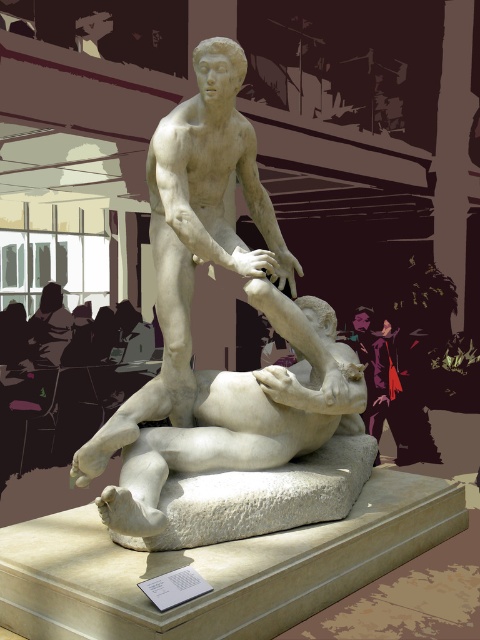
Does white marble statue at center have a lesser height compared to white marble/stone at center?

No, white marble statue at center is not shorter than white marble/stone at center.

Where is `white marble statue at center`? This screenshot has width=480, height=640. white marble statue at center is located at coordinates 190,324.

This screenshot has height=640, width=480. I want to click on white marble statue at center, so click(190, 324).

You are a GUI agent. You are given a task and a screenshot of the screen. Output one action in this format:
    pyautogui.click(x=<x>, y=<y>)
    Task: Click on the white marble statue at center
    This screenshot has width=480, height=640.
    Given the screenshot: What is the action you would take?
    (190, 324)